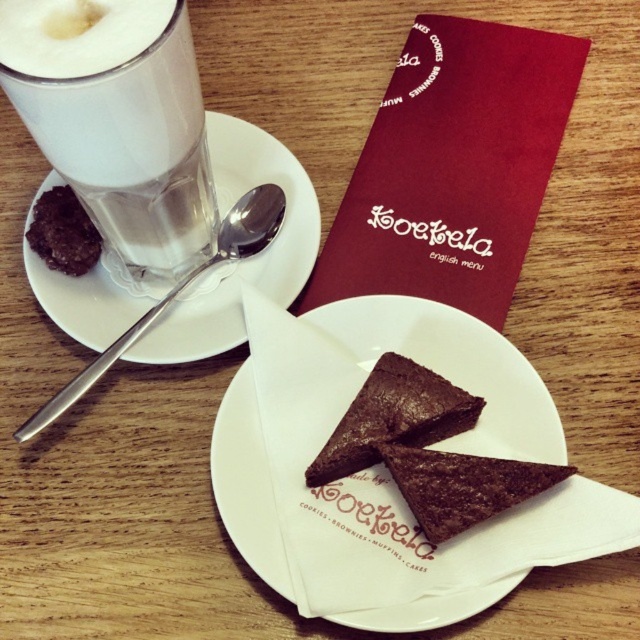
You are a customer at the cafe and want to place your phone on the table. You have a phone that is 15 cm wide. Which object from the white paper plate at center and chocolate matte at center can you place your phone on without it hanging over the edge?

The white paper plate at center is wider than the chocolate matte at center. Since your phone is 15 cm wide, you should place it on the white paper plate at center as it can accommodate the phone without it hanging over the edge.

You are a barista standing at the counter and want to place a new coffee cup exactly at the point marked as point (198, 316). The counter is 30 inches away from you. Can you reach that point?

The distance between you and point (198, 316) is 25.78 inches, which is less than the 30 inches reach of the barista, so yes, the barista can reach that point.